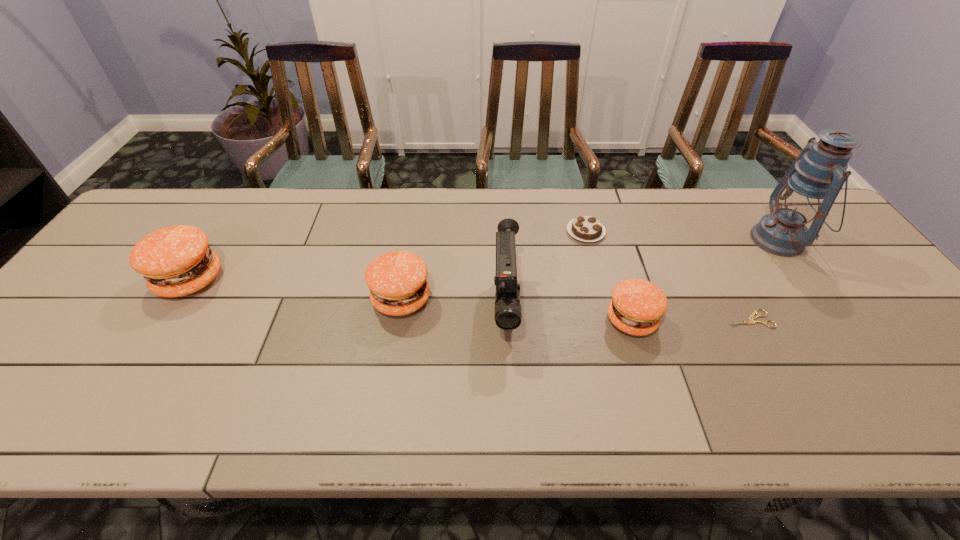
Image resolution: width=960 pixels, height=540 pixels. I want to click on free space located 0.070m on the front-facing side of the second tallest object, so click(x=510, y=380).

The image size is (960, 540). Find the location of `chocolate cake that is at the far edge`. chocolate cake that is at the far edge is located at coordinates (584, 228).

At what (x,y) coordinates should I click in order to perform the action: click on lantern that is at the far edge. Please return your answer as a coordinate pair (x, y). The image size is (960, 540). Looking at the image, I should click on (808, 190).

I want to click on object at the right edge, so click(x=808, y=190).

What are the coordinates of `object positioned at the far right corner` in the screenshot? It's located at pos(808,190).

The height and width of the screenshot is (540, 960). Find the location of `free location at the far edge`. free location at the far edge is located at coordinates (386, 202).

In the image, there is a desktop. Identify the location of blank space at the near edge. (396, 384).

Identify the location of vacant space at the right edge of the desktop. This screenshot has width=960, height=540. (881, 323).

In the image, there is a desktop. What are the coordinates of `free space at the far left corner` in the screenshot? It's located at (193, 193).

In the image, there is a desktop. At what (x,y) coordinates should I click in order to perform the action: click on vacant space at the near right corner. Please return your answer as a coordinate pair (x, y). Looking at the image, I should click on (918, 370).